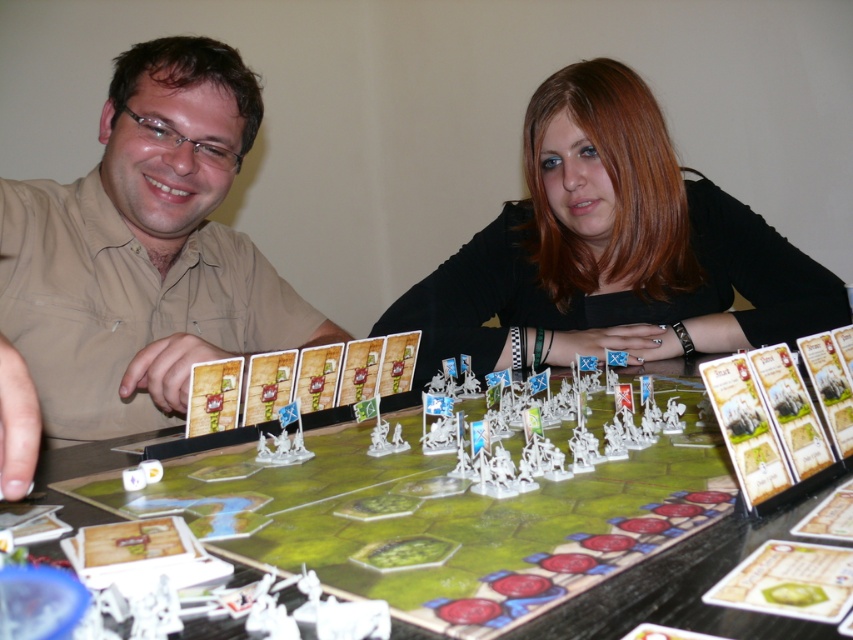
Question: Based on their relative distances, which object is farther from the smooth black shirt at center?

Choices:
 (A) matte plastic figures at center
 (B) green matte board game at center
 (C) matte beige shirt at left

Answer: (C)

Question: Does matte plastic figures at center appear over green matte board game at center?

Choices:
 (A) no
 (B) yes

Answer: (B)

Question: In this image, where is matte plastic figures at center located relative to smooth black shirt at center?

Choices:
 (A) below
 (B) above

Answer: (A)

Question: Is matte plastic figures at center smaller than matte beige shirt at left?

Choices:
 (A) yes
 (B) no

Answer: (B)

Question: Which point is farther from the camera taking this photo?

Choices:
 (A) (721, 336)
 (B) (143, 237)

Answer: (A)

Question: Among these points, which one is nearest to the camera?

Choices:
 (A) (350, 573)
 (B) (144, 332)
 (C) (83, 280)
 (D) (538, 304)

Answer: (A)